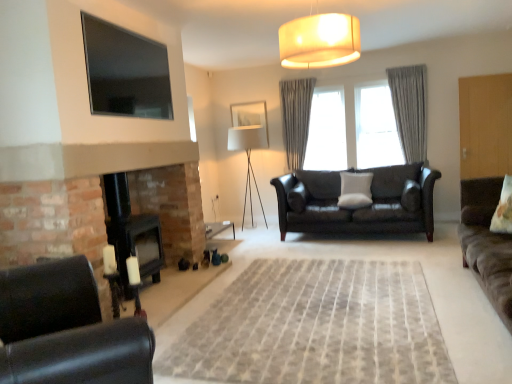
How much space does gray textured curtain at center, the first curtain in the right-to-left sequence, occupy vertically?

gray textured curtain at center, the first curtain in the right-to-left sequence, is 4.85 feet in height.

The width and height of the screenshot is (512, 384). Describe the element at coordinates (154, 216) in the screenshot. I see `black matte fireplace at lower left` at that location.

The image size is (512, 384). What do you see at coordinates (319, 41) in the screenshot?
I see `matte beige lampshade at upper center` at bounding box center [319, 41].

Image resolution: width=512 pixels, height=384 pixels. In order to click on white soft cushion at center, which ranks as the 1th pillow in left-to-right order in this screenshot , I will do `click(355, 190)`.

Measure the distance between light beige curtains at center and camera.

light beige curtains at center is 5.91 meters from camera.

What do you see at coordinates (353, 128) in the screenshot?
I see `light beige curtains at center` at bounding box center [353, 128].

What are the coordinates of `gray textured curtain at center, the 2th curtain positioned from the left` in the screenshot? It's located at (410, 109).

Based on the photo, who is smaller, flat-screen tv at upper left or suede brown sofa at right, acting as the 2th studio couch starting from the back?

Smaller between the two is flat-screen tv at upper left.

Between flat-screen tv at upper left and suede brown sofa at right, acting as the 1th studio couch starting from the front, which one has smaller width?

With smaller width is flat-screen tv at upper left.

Is flat-screen tv at upper left further to camera compared to suede brown sofa at right, acting as the 1th studio couch starting from the front?

Yes, flat-screen tv at upper left is further from the viewer.

Locate an element on the screen. The width and height of the screenshot is (512, 384). window screen on the left of the white fabric picture frame at center is located at coordinates (125, 72).

Is white fabric picture frame at center shorter than flat-screen tv at upper left?

No.

Considering the positions of point (237, 118) and point (108, 99), is point (237, 118) closer or farther from the camera than point (108, 99)?

Point (237, 118).

Would you say matte black couch at center, which appears as the 2th studio couch when viewed from the front, is part of light beige curtains at center's contents?

Definitely not — matte black couch at center, which appears as the 2th studio couch when viewed from the front, is not inside light beige curtains at center.

Considering the relative sizes of light beige curtains at center and matte black couch at center, which is the first studio couch from back to front, in the image provided, is light beige curtains at center wider than matte black couch at center, which is the first studio couch from back to front,?

No.

Considering the relative positions of light beige curtains at center and matte black couch at center, which appears as the 2th studio couch when viewed from the front, in the image provided, is light beige curtains at center behind matte black couch at center, which appears as the 2th studio couch when viewed from the front,?

Yes, light beige curtains at center is further from the camera.

Considering the sizes of light beige curtains at center and matte black couch at center, which is the first studio couch from back to front, in the image, is light beige curtains at center bigger or smaller than matte black couch at center, which is the first studio couch from back to front,?

Considering their sizes, light beige curtains at center takes up less space than matte black couch at center, which is the first studio couch from back to front.

From the image's perspective, is white fabric picture frame at center above or below suede brown sofa at right, acting as the 2th studio couch starting from the back?

white fabric picture frame at center is situated higher than suede brown sofa at right, acting as the 2th studio couch starting from the back, in the image.

Which object is closer to the camera taking this photo, white fabric picture frame at center or suede brown sofa at right, acting as the 1th studio couch starting from the front?

suede brown sofa at right, acting as the 1th studio couch starting from the front, is closer to the camera.

Can you confirm if white fabric picture frame at center is bigger than suede brown sofa at right, acting as the 2th studio couch starting from the back?

Actually, white fabric picture frame at center might be smaller than suede brown sofa at right, acting as the 2th studio couch starting from the back.

You are a GUI agent. You are given a task and a screenshot of the screen. Output one action in this format:
    pyautogui.click(x=<x>, y=<y>)
    Task: Click on the picture frame behind the suede brown sofa at right, acting as the 2th studio couch starting from the back
    The width and height of the screenshot is (512, 384).
    Given the screenshot: What is the action you would take?
    pyautogui.click(x=248, y=126)

From a real-world perspective, is black matte fireplace at lower left located higher than suede brown sofa at right, acting as the 1th studio couch starting from the front?

Yes.

I want to click on fireplace above the suede brown sofa at right, acting as the 2th studio couch starting from the back (from a real-world perspective), so click(x=154, y=216).

Which of these two, black matte fireplace at lower left or suede brown sofa at right, acting as the 1th studio couch starting from the front, stands shorter?

Standing shorter between the two is suede brown sofa at right, acting as the 1th studio couch starting from the front.

Between black matte fireplace at lower left and suede brown sofa at right, acting as the 2th studio couch starting from the back, which one is positioned in front?

suede brown sofa at right, acting as the 2th studio couch starting from the back, is closer to the camera.

Measure the distance from neutral woven rug at center to gray textured curtain at center, positioned as the second curtain in right-to-left order.

A distance of 3.36 meters exists between neutral woven rug at center and gray textured curtain at center, positioned as the second curtain in right-to-left order.

Is neutral woven rug at center inside the boundaries of gray textured curtain at center, which appears as the 1th curtain when viewed from the left, or outside?

neutral woven rug at center is spatially situated outside gray textured curtain at center, which appears as the 1th curtain when viewed from the left.

Does neutral woven rug at center have a greater width compared to gray textured curtain at center, which appears as the 1th curtain when viewed from the left?

Indeed, neutral woven rug at center has a greater width compared to gray textured curtain at center, which appears as the 1th curtain when viewed from the left.

Is point (406, 282) positioned in front of point (293, 168)?

Yes, it is in front of point (293, 168).

Is point (349, 181) closer or farther from the camera than point (153, 269)?

Clearly, point (349, 181) is more distant from the camera than point (153, 269).

Who is shorter, white soft cushion at center, which is the 1th pillow in back-to-front order, or black matte fireplace at lower left?

white soft cushion at center, which is the 1th pillow in back-to-front order.

You are a GUI agent. You are given a task and a screenshot of the screen. Output one action in this format:
    pyautogui.click(x=<x>, y=<y>)
    Task: Click on the fireplace lying in front of the white soft cushion at center, the second pillow in the front-to-back sequence
    The width and height of the screenshot is (512, 384).
    Given the screenshot: What is the action you would take?
    pyautogui.click(x=154, y=216)

Where is `studio couch that is in front of the flat-screen tv at upper left`? This screenshot has width=512, height=384. studio couch that is in front of the flat-screen tv at upper left is located at coordinates (486, 243).

Identify the location of picture frame behind the flat-screen tv at upper left. (248, 126).

Looking at the image, which one is located closer to black leather chair at lower left, flat-screen tv at upper left or gray textured curtain at center, the 2th curtain positioned from the left?

flat-screen tv at upper left lies closer to black leather chair at lower left than the other object.

Considering their positions, is neutral woven rug at center positioned further to white fabric lamp at center than white fabric pillow at right, the 1th pillow from the right?

Among the two, white fabric pillow at right, the 1th pillow from the right, is located further to white fabric lamp at center.

From the image, which object appears to be farther from white fabric picture frame at center, gray textured curtain at center, which appears as the 1th curtain when viewed from the left, or matte beige lampshade at upper center?

The object further to white fabric picture frame at center is matte beige lampshade at upper center.

Based on their spatial positions, is black matte fireplace at lower left or gray textured curtain at center, the first curtain in the right-to-left sequence, closer to suede brown sofa at right, acting as the 1th studio couch starting from the front?

gray textured curtain at center, the first curtain in the right-to-left sequence.

Looking at the image, which one is located further to white fabric pillow at right, the 1th pillow from the right, flat-screen tv at upper left or black leather chair at lower left?

The object further to white fabric pillow at right, the 1th pillow from the right, is flat-screen tv at upper left.

Looking at the image, which one is located closer to white soft cushion at center, which is the 1th pillow in back-to-front order, matte beige lampshade at upper center or flat-screen tv at upper left?

matte beige lampshade at upper center lies closer to white soft cushion at center, which is the 1th pillow in back-to-front order, than the other object.

Looking at the image, which one is located further to suede brown sofa at right, acting as the 1th studio couch starting from the front, gray textured curtain at center, the 2th curtain positioned from the left, or white fabric lamp at center?

white fabric lamp at center is positioned further to the anchor suede brown sofa at right, acting as the 1th studio couch starting from the front.

Based on their spatial positions, is suede brown sofa at right, acting as the 2th studio couch starting from the back, or matte beige lampshade at upper center closer to black leather chair at lower left?

The object closer to black leather chair at lower left is matte beige lampshade at upper center.

The width and height of the screenshot is (512, 384). I want to click on window screen located between suede brown sofa at right, acting as the 1th studio couch starting from the front, and white fabric picture frame at center in the depth direction, so click(125, 72).

Where is `studio couch located between matte beige lampshade at upper center and gray textured curtain at center, positioned as the second curtain in right-to-left order, in the depth direction`? The height and width of the screenshot is (384, 512). studio couch located between matte beige lampshade at upper center and gray textured curtain at center, positioned as the second curtain in right-to-left order, in the depth direction is located at coordinates (360, 208).

Image resolution: width=512 pixels, height=384 pixels. In order to click on lamp located between neutral woven rug at center and white fabric picture frame at center in the depth direction in this screenshot , I will do `click(248, 156)`.

I want to click on plain positioned between black leather chair at lower left and gray textured curtain at center, positioned as the second curtain in right-to-left order, from near to far, so pyautogui.click(x=316, y=327).